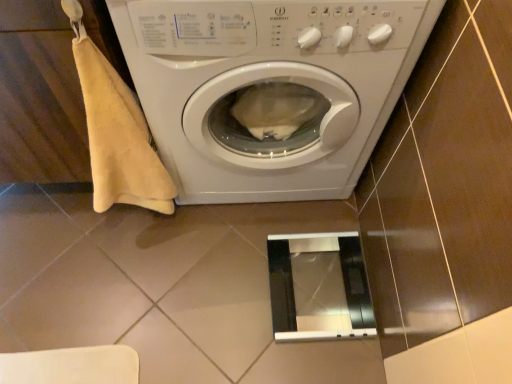
At what (x,y) coordinates should I click in order to perform the action: click on vacant space that is to the left of metallic silver screen door at lower center. Please return your answer as a coordinate pair (x, y). Image resolution: width=512 pixels, height=384 pixels. Looking at the image, I should click on (227, 284).